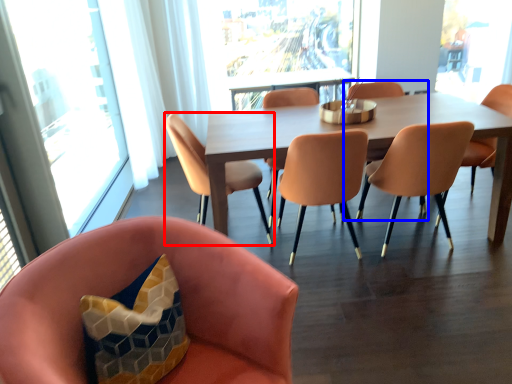
Question: Which of the following is the closest to the observer, chair (highlighted by a red box) or armchair (highlighted by a blue box)?

Choices:
 (A) chair
 (B) armchair

Answer: (A)